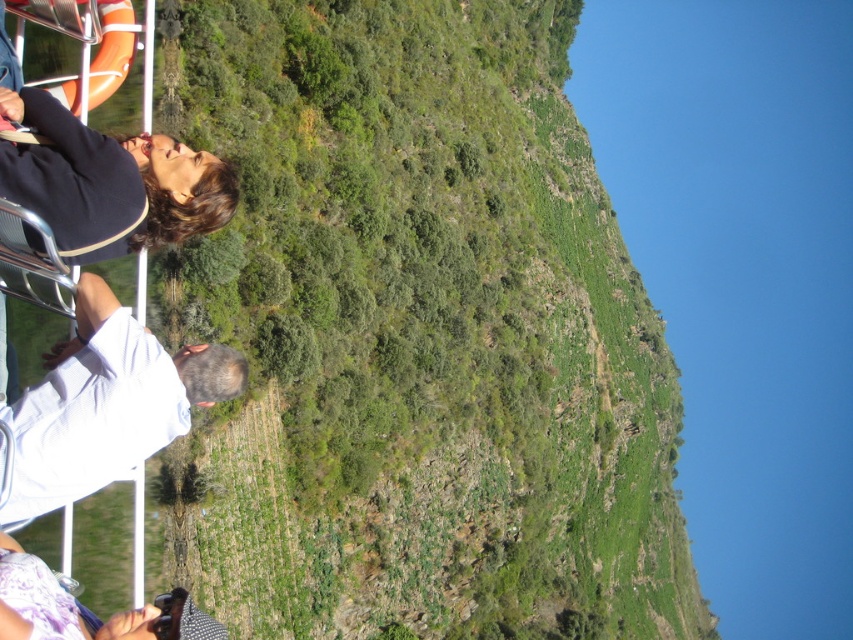
Based on the scene description, where is the green leafy hillside at upper left located in the image?

The green leafy hillside at upper left is located at point (416, 336) in the image.

You are standing on a boat looking at the green leafy hillside at upper left and the matte black shirt at left. Which object is bigger?

The green leafy hillside at upper left is larger than the matte black shirt at left.